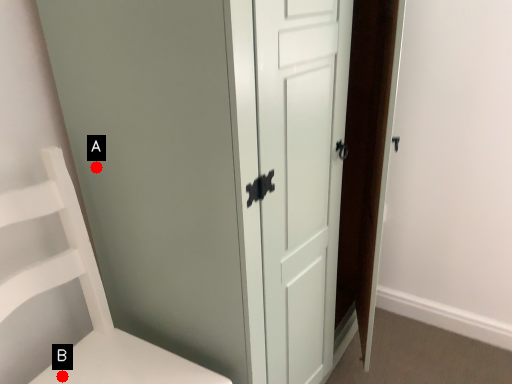
Question: Two points are circled on the image, labeled by A and B beside each circle. Which point appears closest to the camera in this image?

Choices:
 (A) A is closer
 (B) B is closer

Answer: (B)